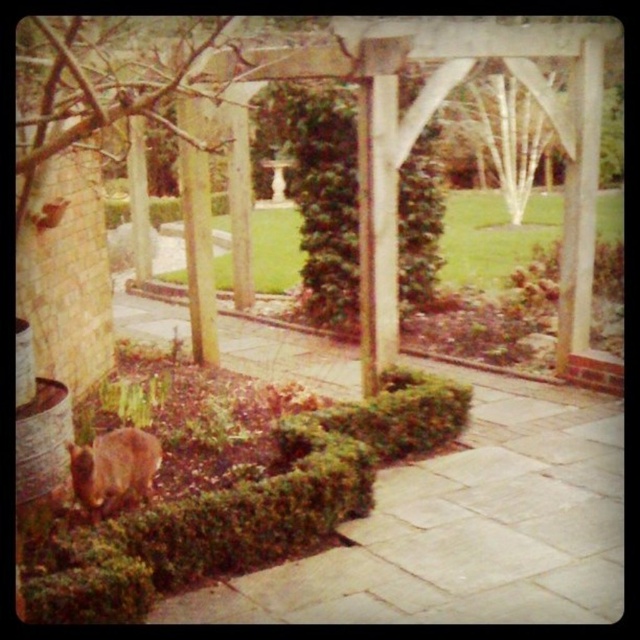
You are a gardener who wants to place a small statue between the green leafy bush at center and the brown furry rabbit at lower left. Where should you position the statue so it is equidistant from both objects?

The green leafy bush at center is to the right of the brown furry rabbit at lower left, so the statue should be placed midway between them along the line connecting their positions to ensure equal distance from both.

You are a gardener who wants to place a small statue between the green leafy bush at center and the brown furry rabbit at lower left. Which side of the statue should face the wider object?

The green leafy bush at center might be wider than the brown furry rabbit at lower left, so the statue should be placed with its front facing the green leafy bush at center.

Based on the photo, you are a gardener standing on the paved pathway in the center of the garden. You see the green leafy bush at center and the brown furry rabbit at lower left. From your position, which object is closer to you?

The green leafy bush at center is closer to you because the brown furry rabbit at lower left is behind it.